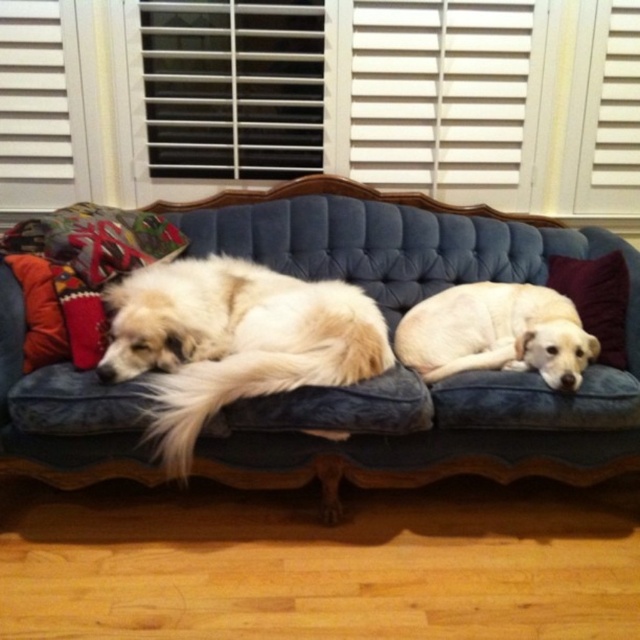
Question: Is velvet blue couch at center to the right of purple velvet pillow at right from the viewer's perspective?

Choices:
 (A) yes
 (B) no

Answer: (B)

Question: Is light yellow fur at center above purple velvet pillow at right?

Choices:
 (A) no
 (B) yes

Answer: (A)

Question: Which object is the closest to the white fluffy dog at left?

Choices:
 (A) light yellow fur at center
 (B) purple velvet pillow at right

Answer: (A)

Question: Does velvet blue couch at center have a larger size compared to purple velvet pillow at right?

Choices:
 (A) yes
 (B) no

Answer: (A)

Question: Which object is positioned closest to the light yellow fur at center?

Choices:
 (A) white fluffy dog at left
 (B) velvet blue couch at center

Answer: (B)

Question: Which point is closer to the camera taking this photo?

Choices:
 (A) (132, 310)
 (B) (573, 465)
 (C) (564, 289)

Answer: (A)